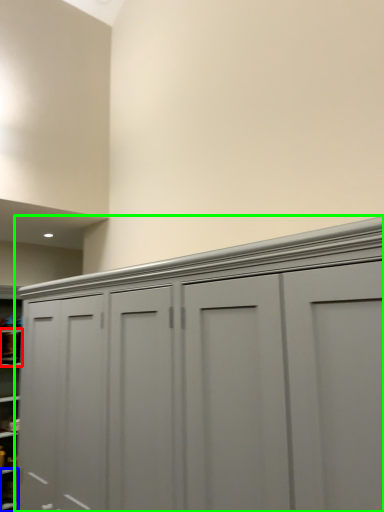
Question: Which is nearer to the cabinet (highlighted by a red box)? cabinet (highlighted by a blue box) or cupboard (highlighted by a green box).

Choices:
 (A) cabinet
 (B) cupboard

Answer: (A)